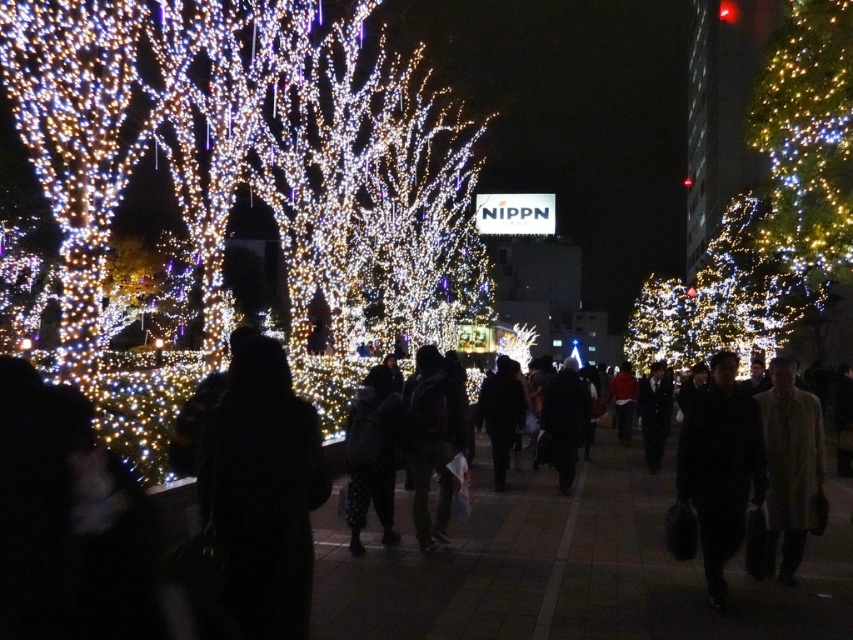
You are a customer browsing through a winter clothing store. You see a beige wool coat at lower right and a dark gray fabric jacket at center. Which item is closer to you?

The beige wool coat at lower right is closer to you since it is in front of the dark gray fabric jacket at center.

You are a salesperson in a clothing store and need to place the dark fabric coat at center and the red matte jacket at center on a single mannequin. Since the mannequin has limited space, which item should you prioritize placing first to ensure both fit?

The dark fabric coat at center is wider than the red matte jacket at center. To ensure both fit on the mannequin, you should place the wider dark fabric coat at center first and then the narrower red matte jacket at center on top or beside it.

You are a tailor who needs to determine which garment takes up more space horizontally when laid flat. Based on the scene, which one is wider between the dark gray fabric jacket at center and the dark fabric coat at center?

The dark fabric coat at center is wider than the dark gray fabric jacket at center, so the dark fabric coat at center takes up more horizontal space when laid flat.